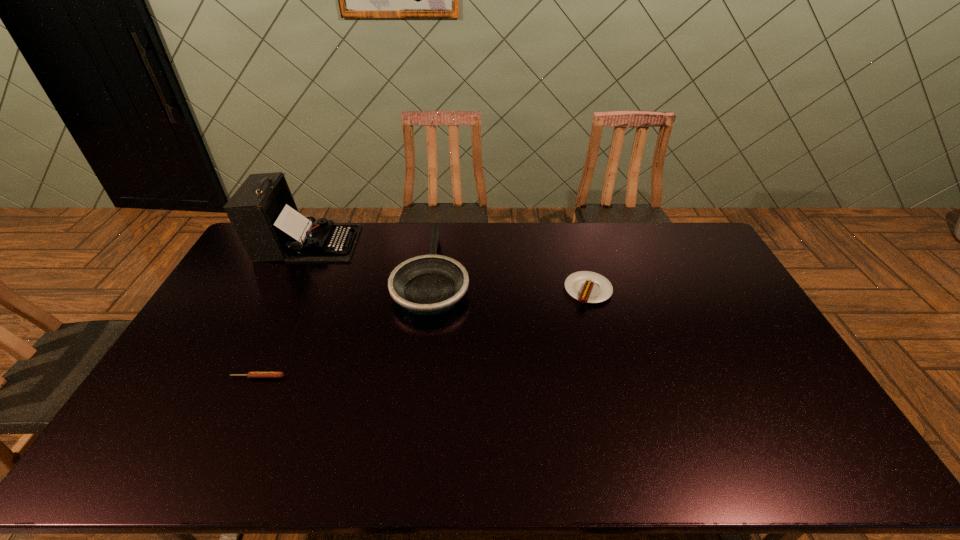
I want to click on typewriter present at the far edge, so click(x=262, y=211).

Image resolution: width=960 pixels, height=540 pixels. In order to click on frying pan located in the far edge section of the desktop in this screenshot , I will do `click(431, 284)`.

You are a GUI agent. You are given a task and a screenshot of the screen. Output one action in this format:
    pyautogui.click(x=<x>, y=<y>)
    Task: Click on the object that is at the left edge
    This screenshot has height=540, width=960.
    Given the screenshot: What is the action you would take?
    pyautogui.click(x=262, y=211)

You are a GUI agent. You are given a task and a screenshot of the screen. Output one action in this format:
    pyautogui.click(x=<x>, y=<y>)
    Task: Click on the object that is at the far left corner
    This screenshot has height=540, width=960.
    Given the screenshot: What is the action you would take?
    pyautogui.click(x=262, y=211)

In order to click on vacant space at the far edge of the desktop in this screenshot , I will do `click(664, 256)`.

I want to click on free spot at the near edge of the desktop, so click(471, 440).

Find the location of a particular element. This screenshot has width=960, height=540. free space at the right edge is located at coordinates (719, 289).

Locate an element on the screen. The width and height of the screenshot is (960, 540). free region at the far right corner is located at coordinates (691, 237).

Find the location of a particular element. The width and height of the screenshot is (960, 540). free space between the rightmost object and the shorter sausage is located at coordinates (423, 334).

At what (x,y) coordinates should I click in order to perform the action: click on vacant area that lies between the frying pan and the typewriter. Please return your answer as a coordinate pair (x, y). Image resolution: width=960 pixels, height=540 pixels. Looking at the image, I should click on (370, 258).